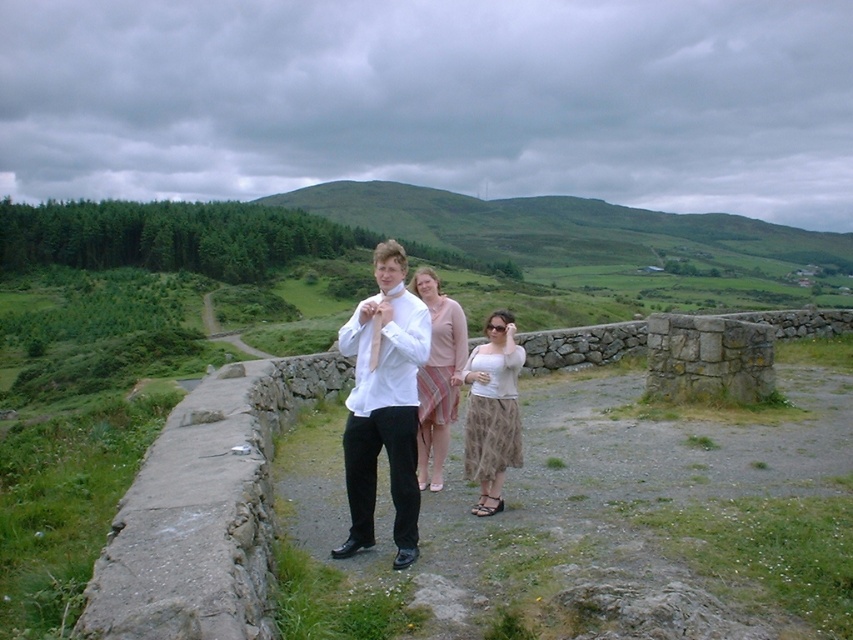
Is beige textured skirt at center positioned behind pink striped skirt at center?

Yes, it is.

Looking at this image, between beige textured skirt at center and pink striped skirt at center, which one appears on the left side from the viewer's perspective?

pink striped skirt at center is more to the left.

I want to click on beige textured skirt at center, so click(x=492, y=412).

Between matte white shirt at center and pink striped skirt at center, which one appears on the left side from the viewer's perspective?

matte white shirt at center is more to the left.

Measure the distance between matte white shirt at center and camera.

A distance of 15.64 feet exists between matte white shirt at center and camera.

The height and width of the screenshot is (640, 853). Identify the location of matte white shirt at center. (383, 403).

Between point (410, 563) and point (486, 465), which one is positioned behind?

Point (486, 465)

Identify the location of matte white shirt at center. (383, 403).